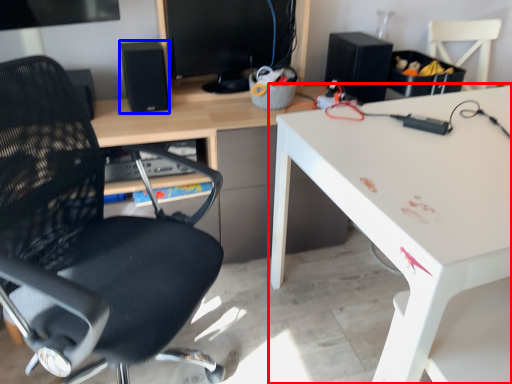
Question: Which of the following is the farthest to the observer, desk (highlighted by a red box) or speaker (highlighted by a blue box)?

Choices:
 (A) desk
 (B) speaker

Answer: (B)